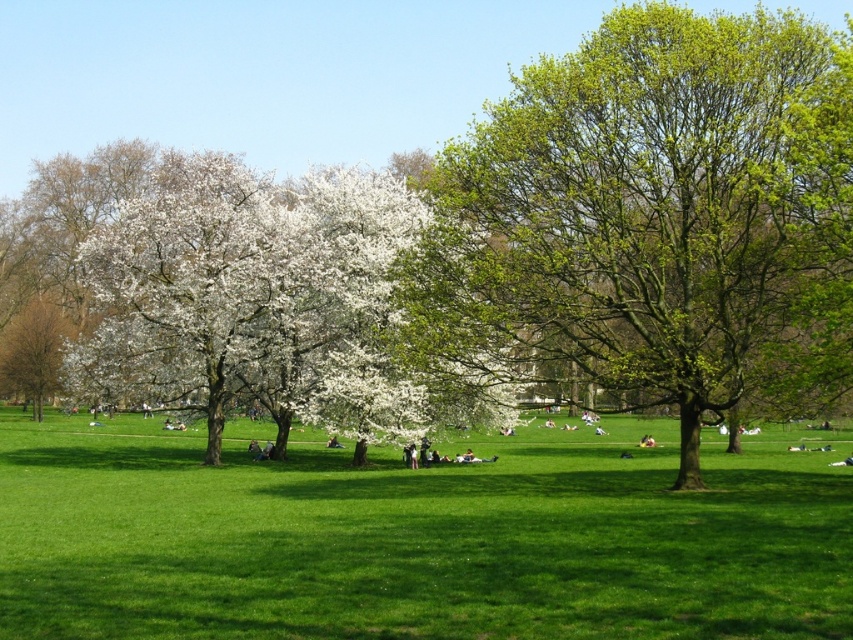
Question: Which object is farther from the camera taking this photo?

Choices:
 (A) smooth white blossoms at left
 (B) green grassy field at center
 (C) white blossoms at center

Answer: (A)

Question: Is green grassy field at center to the left of white blossoms at center from the viewer's perspective?

Choices:
 (A) no
 (B) yes

Answer: (A)

Question: Is green leafy tree at center wider than white blossoms at center?

Choices:
 (A) no
 (B) yes

Answer: (A)

Question: Among these points, which one is nearest to the camera?

Choices:
 (A) (225, 451)
 (B) (3, 342)

Answer: (A)

Question: Which point is farther to the camera?

Choices:
 (A) white blossoms at center
 (B) green grassy field at center

Answer: (A)

Question: From the image, what is the correct spatial relationship of green grassy field at center in relation to white blossoms at center?

Choices:
 (A) above
 (B) below

Answer: (B)